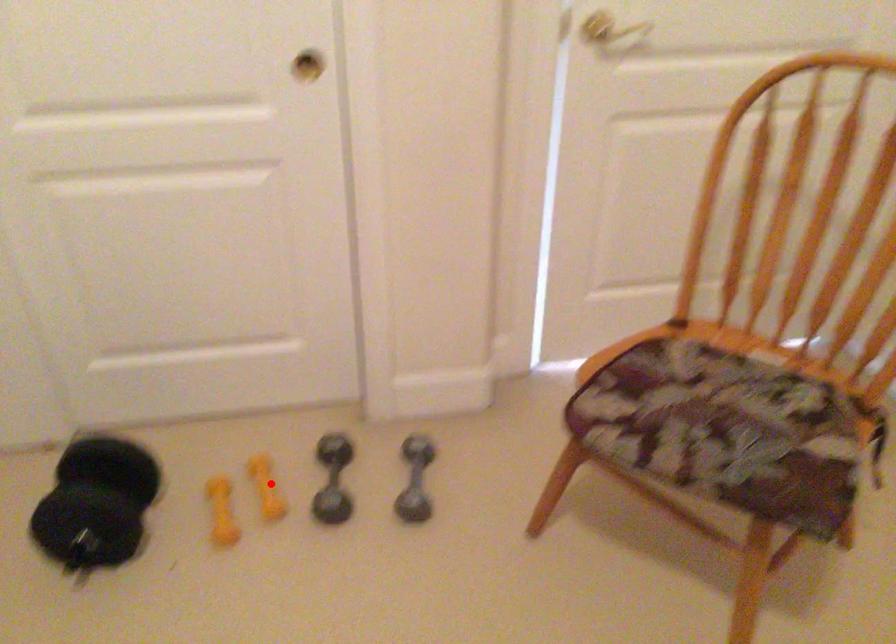
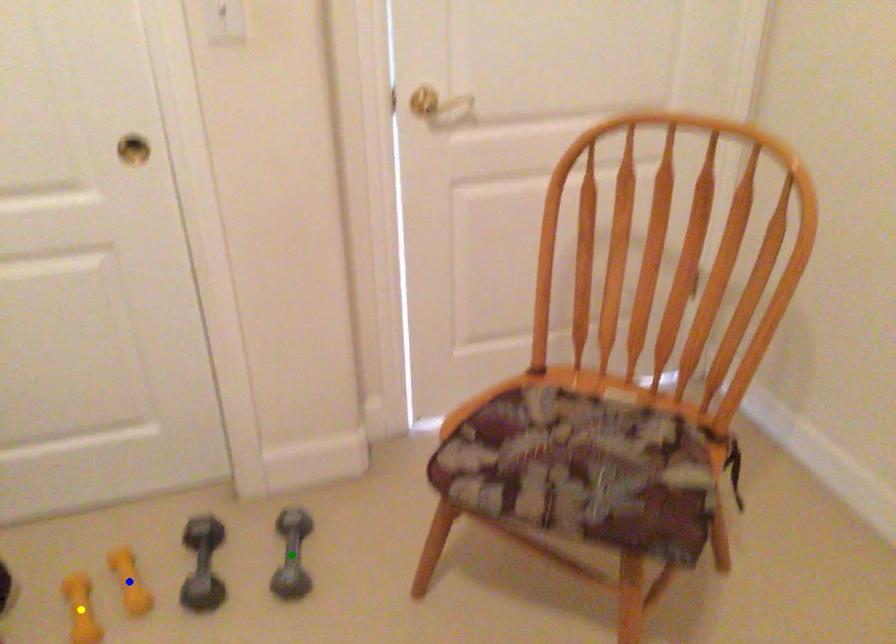
Question: I am providing you with two images of the same scene from different viewpoints. A red point is marked on the first image. You are given multiple points on the second image. Can you choose the point in image 2 that corresponds to the point in image 1?

Choices:
 (A) green point
 (B) yellow point
 (C) blue point

Answer: (C)